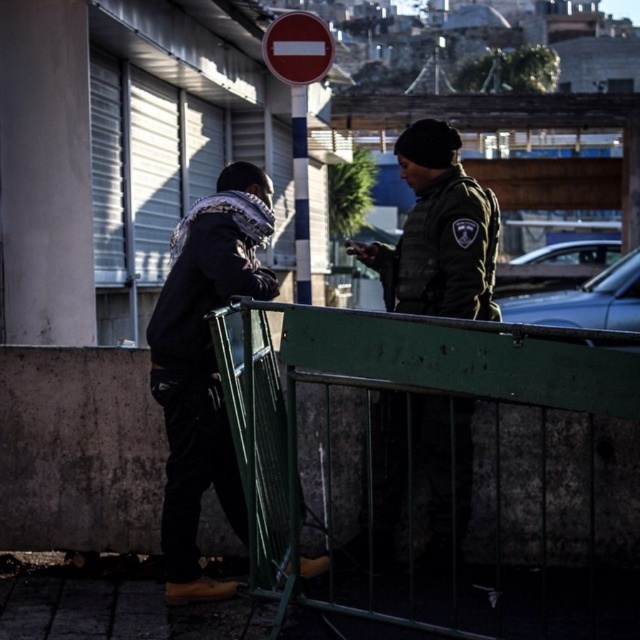
Locate an element on the screen. green metal fence at center is located at coordinates (449, 467).

Is point (573, 508) positioned before point (296, 60)?

Yes.

Is point (289, 445) behind point (285, 45)?

No, it is not.

Where is `green metal fence at center`? green metal fence at center is located at coordinates (449, 467).

Is green metal fence at center taller than green matte uniform at center?

Yes.

Identify the location of green metal fence at center. The width and height of the screenshot is (640, 640). (449, 467).

You are a GUI agent. You are given a task and a screenshot of the screen. Output one action in this format:
    pyautogui.click(x=<x>, y=<y>)
    Task: Click on the green metal fence at center
    The height and width of the screenshot is (640, 640).
    Given the screenshot: What is the action you would take?
    pyautogui.click(x=449, y=467)

Can you confirm if green matte uniform at center is smaller than red matte sign at upper center?

No.

Can you confirm if green matte uniform at center is positioned to the left of red matte sign at upper center?

No, green matte uniform at center is not to the left of red matte sign at upper center.

Which is behind, point (428, 262) or point (292, 22)?

Positioned behind is point (292, 22).

I want to click on green matte uniform at center, so click(x=436, y=232).